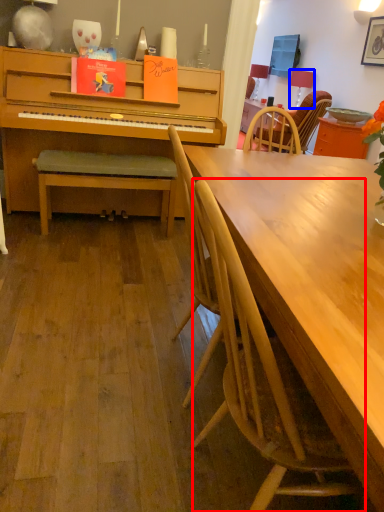
Question: Which of the following is the closest to the observer, chair (highlighted by a red box) or lamp (highlighted by a blue box)?

Choices:
 (A) chair
 (B) lamp

Answer: (A)